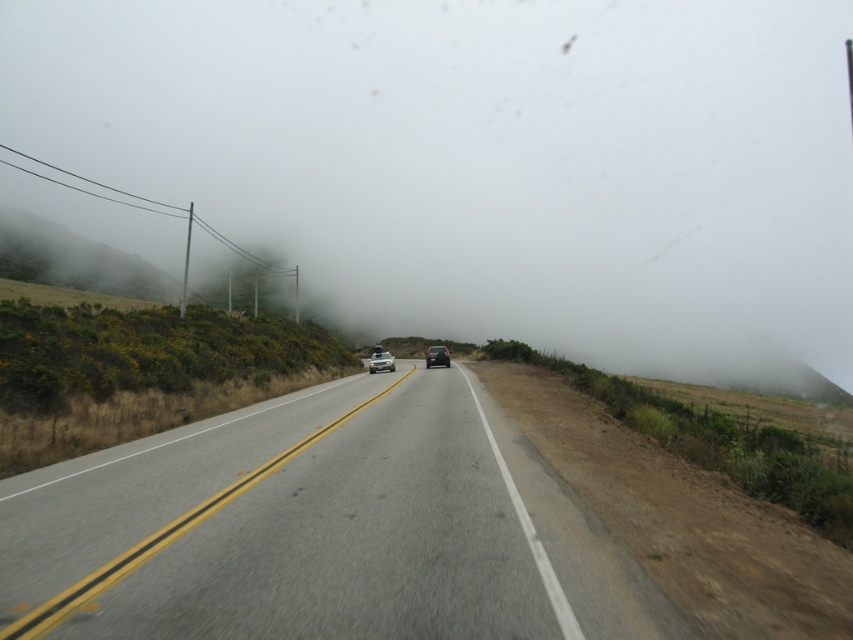
Can you confirm if asphalt road at center is bigger than shiny black sedan at center?

No, asphalt road at center is not bigger than shiny black sedan at center.

Is asphalt road at center wider than shiny black sedan at center?

Indeed, asphalt road at center has a greater width compared to shiny black sedan at center.

Consider the image. Measure the distance between point (x=97, y=490) and camera.

Point (x=97, y=490) and camera are 29.30 feet apart from each other.

Locate an element on the screen. Image resolution: width=853 pixels, height=640 pixels. asphalt road at center is located at coordinates (320, 529).

Which is above, satin silver sedan at center or shiny black sedan at center?

shiny black sedan at center is above.

Does satin silver sedan at center appear under shiny black sedan at center?

Yes.

Does point (374, 369) lie behind point (439, 348)?

No, (374, 369) is in front of (439, 348).

Where is `satin silver sedan at center`? satin silver sedan at center is located at coordinates (381, 362).

Is asphalt road at center closer to the viewer compared to satin silver sedan at center?

Yes, it is in front of satin silver sedan at center.

Does point (508, 540) come in front of point (374, 356)?

Yes, it is.

I want to click on asphalt road at center, so click(320, 529).